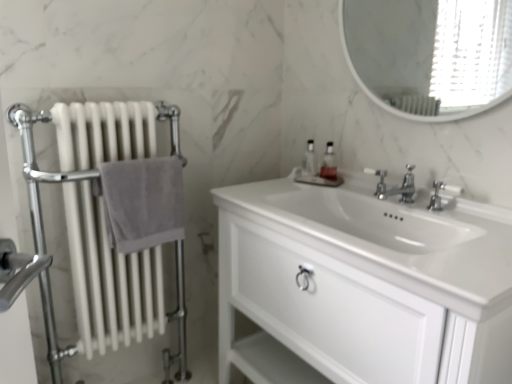
Question: Is translucent plastic soap dispenser at center, the first soap dispenser in the right-to-left sequence, positioned far away from polished chrome faucet at center?

Choices:
 (A) yes
 (B) no

Answer: (B)

Question: From a real-world perspective, is translucent plastic soap dispenser at center, the 2th soap dispenser when ordered from left to right, positioned over polished chrome faucet at center based on gravity?

Choices:
 (A) yes
 (B) no

Answer: (A)

Question: Does translucent plastic soap dispenser at center, the 2th soap dispenser when ordered from left to right, have a lesser height compared to polished chrome faucet at center?

Choices:
 (A) yes
 (B) no

Answer: (B)

Question: Is translucent plastic soap dispenser at center, the first soap dispenser in the right-to-left sequence, in front of polished chrome faucet at center?

Choices:
 (A) yes
 (B) no

Answer: (B)

Question: From the image's perspective, is translucent plastic soap dispenser at center, the 2th soap dispenser when ordered from left to right, on top of polished chrome faucet at center?

Choices:
 (A) yes
 (B) no

Answer: (A)

Question: Is translucent plastic soap dispenser at center, the 2th soap dispenser when ordered from left to right, at the left side of polished chrome faucet at center?

Choices:
 (A) no
 (B) yes

Answer: (B)

Question: Is translucent plastic soap dispenser at center, the first soap dispenser in the right-to-left sequence, not within white glossy cabinet at center?

Choices:
 (A) no
 (B) yes

Answer: (B)

Question: Considering the relative positions of translucent plastic soap dispenser at center, the 2th soap dispenser when ordered from left to right, and white glossy cabinet at center in the image provided, is translucent plastic soap dispenser at center, the 2th soap dispenser when ordered from left to right, in front of white glossy cabinet at center?

Choices:
 (A) no
 (B) yes

Answer: (A)

Question: Does translucent plastic soap dispenser at center, the first soap dispenser in the right-to-left sequence, lie behind white glossy cabinet at center?

Choices:
 (A) no
 (B) yes

Answer: (B)

Question: Considering the relative sizes of translucent plastic soap dispenser at center, the 2th soap dispenser when ordered from left to right, and white glossy cabinet at center in the image provided, is translucent plastic soap dispenser at center, the 2th soap dispenser when ordered from left to right, bigger than white glossy cabinet at center?

Choices:
 (A) yes
 (B) no

Answer: (B)

Question: Is white glossy cabinet at center located within translucent plastic soap dispenser at center, the 2th soap dispenser when ordered from left to right?

Choices:
 (A) no
 (B) yes

Answer: (A)

Question: Does translucent plastic soap dispenser at center, the 2th soap dispenser when ordered from left to right, have a greater height compared to white glossy cabinet at center?

Choices:
 (A) no
 (B) yes

Answer: (A)

Question: From a real-world perspective, is white glossy cabinet at center under polished chrome faucet at center, the 1th tap viewed from the right?

Choices:
 (A) yes
 (B) no

Answer: (A)